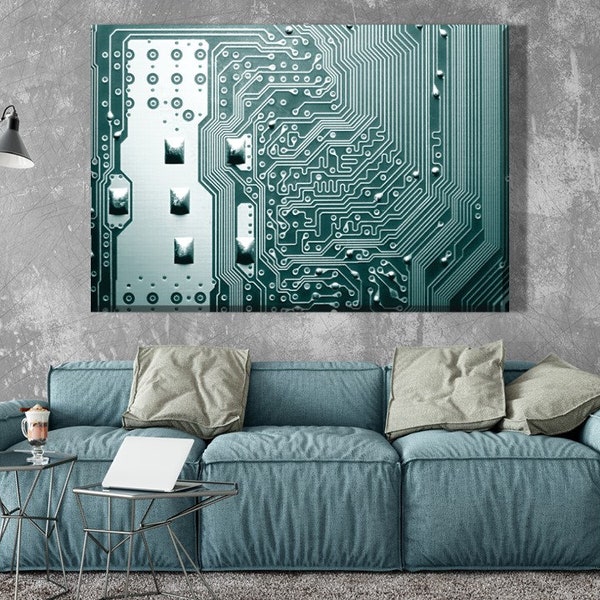
Locate an element on the screen. The image size is (600, 600). glass is located at coordinates (36, 425).